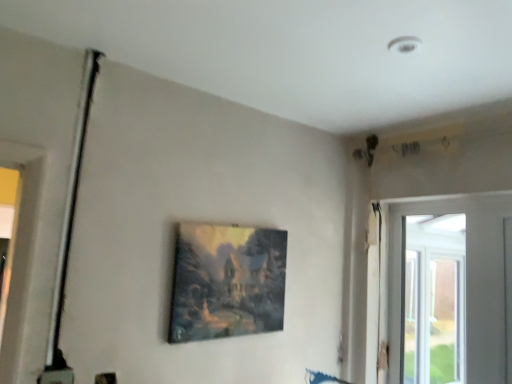
Question: Is matte wooden picture frame at center situated inside transparent glass window at right or outside?

Choices:
 (A) outside
 (B) inside

Answer: (A)

Question: Considering the positions of matte wooden picture frame at center and transparent glass window at right in the image, is matte wooden picture frame at center taller or shorter than transparent glass window at right?

Choices:
 (A) tall
 (B) short

Answer: (B)

Question: Based on their sizes in the image, would you say matte wooden picture frame at center is bigger or smaller than transparent glass window at right?

Choices:
 (A) small
 (B) big

Answer: (A)

Question: Is transparent glass window at right wider or thinner than matte wooden picture frame at center?

Choices:
 (A) wide
 (B) thin

Answer: (B)

Question: From the image's perspective, is transparent glass window at right located above or below matte wooden picture frame at center?

Choices:
 (A) below
 (B) above

Answer: (A)

Question: Considering the relative positions of transparent glass window at right and matte wooden picture frame at center in the image provided, is transparent glass window at right to the left or to the right of matte wooden picture frame at center?

Choices:
 (A) left
 (B) right

Answer: (B)

Question: Is transparent glass window at right in front of or behind matte wooden picture frame at center in the image?

Choices:
 (A) front
 (B) behind

Answer: (B)